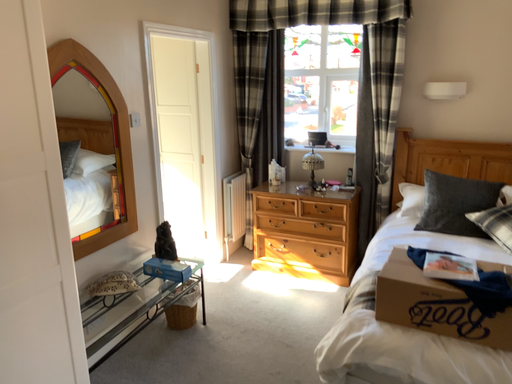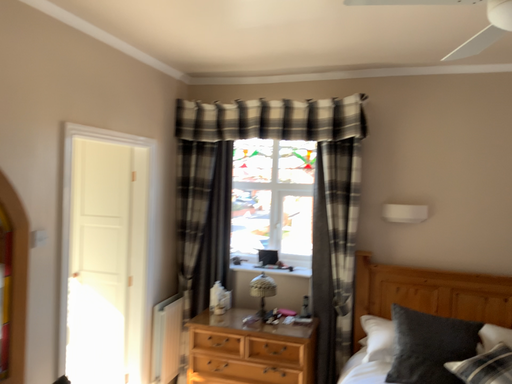
Question: How did the camera likely rotate when shooting the video?

Choices:
 (A) rotated downward
 (B) rotated upward

Answer: (B)